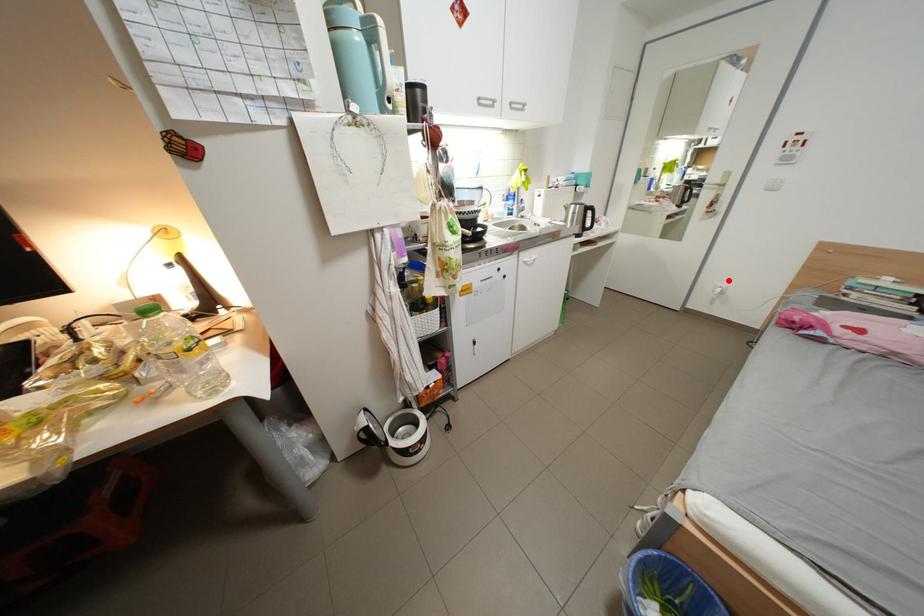
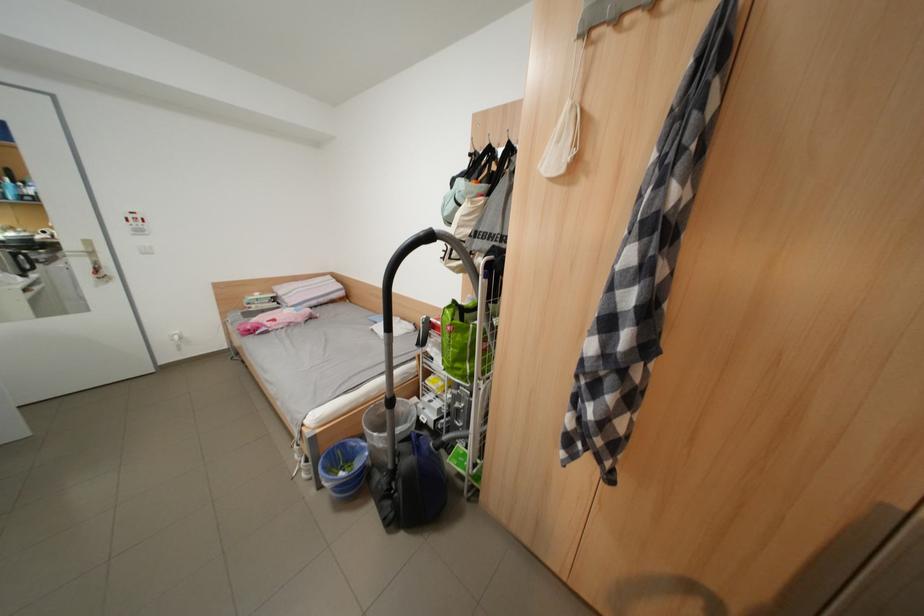
Locate, in the second image, the point that corresponds to the highlighted location in the first image.

(178, 331)